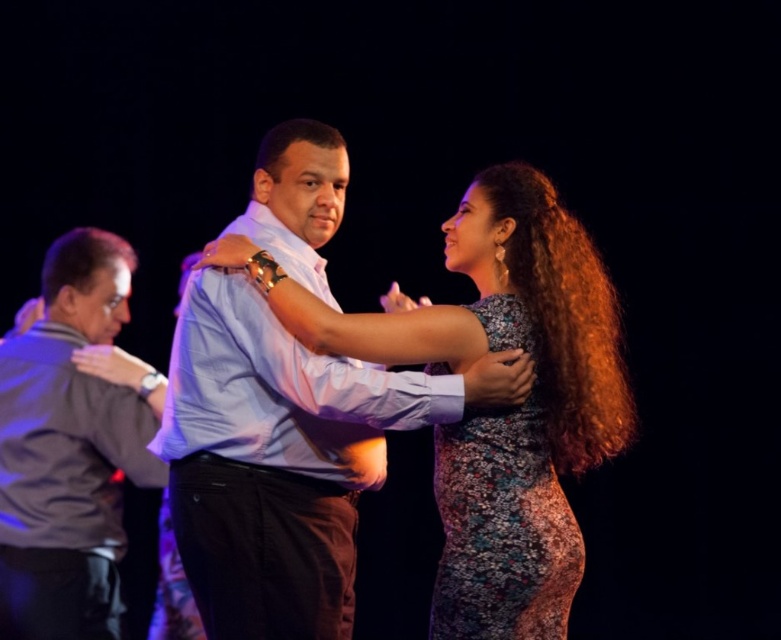
Question: Does floral dress at center have a smaller size compared to gray fabric shirt at left?

Choices:
 (A) yes
 (B) no

Answer: (B)

Question: Which point is farther to the camera?

Choices:
 (A) (537, 481)
 (B) (20, 544)
 (C) (551, 627)

Answer: (B)

Question: Where is gray fabric shirt at left located in relation to floral lace dress at center in the image?

Choices:
 (A) below
 (B) above

Answer: (B)

Question: Does gray fabric shirt at left have a greater width compared to floral lace dress at center?

Choices:
 (A) yes
 (B) no

Answer: (A)

Question: Which point appears farthest from the camera in this image?

Choices:
 (A) (109, 604)
 (B) (526, 524)
 (C) (537, 323)

Answer: (A)

Question: Which point is closer to the camera?

Choices:
 (A) (471, 518)
 (B) (537, 244)
 (C) (73, 371)

Answer: (A)